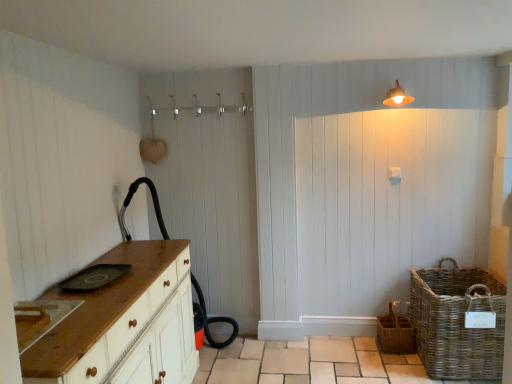
Find the location of `free space that is in between woven brown basket at lower right, the 2th basket when ordered from left to right, and woven wicker basket at lower right, positioned as the 1th basket in left-to-right order`. free space that is in between woven brown basket at lower right, the 2th basket when ordered from left to right, and woven wicker basket at lower right, positioned as the 1th basket in left-to-right order is located at coordinates (400, 363).